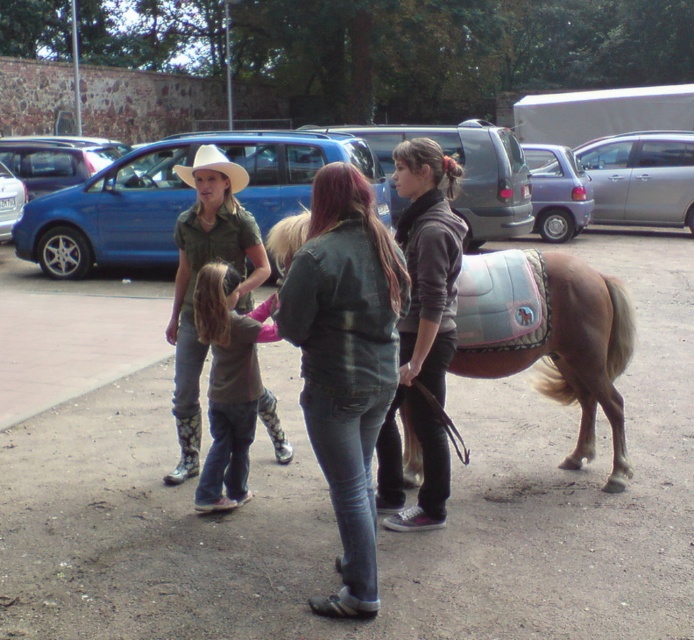
You are a photographer trying to capture a portrait of the person wearing the matte green shirt at center and the brown denim pants at center. Since you want to focus on their clothing, which part of their outfit should be on the left side in the photo?

The matte green shirt at center should be on the left side of the brown denim pants at center in the photo because the matte green shirt at center is positioned on the left side of brown denim pants at center.

You are a photographer trying to capture a clear shot of the light brown leather saddle at lower right and the brown denim pants at center. Since you want to focus on the saddle, which object should you ensure is positioned higher in your frame?

The light brown leather saddle at lower right has a greater height compared to the brown denim pants at center, so you should position the light brown leather saddle at lower right higher in your frame to emphasize its focus.